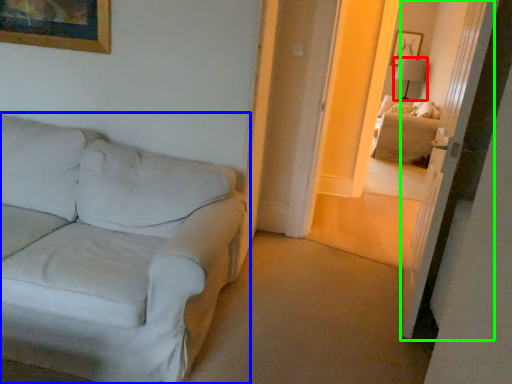
Question: Considering the real-world distances, which object is farthest from table lamp (highlighted by a red box)? studio couch (highlighted by a blue box) or glass door (highlighted by a green box)?

Choices:
 (A) studio couch
 (B) glass door

Answer: (A)